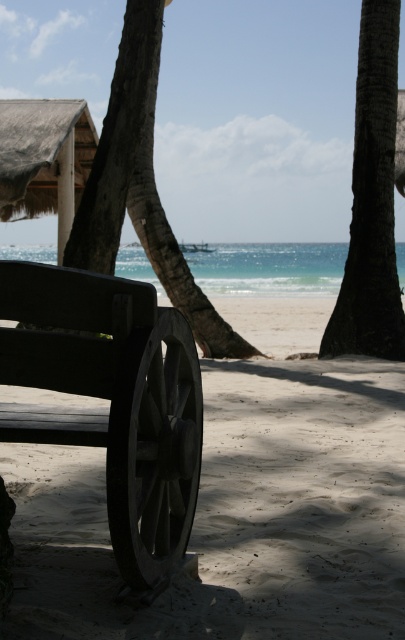
Question: Among these points, which one is farthest from the camera?

Choices:
 (A) (396, 336)
 (B) (138, 387)
 (C) (279, 426)
 (D) (130, 518)

Answer: (A)

Question: Which point is farther to the camera?

Choices:
 (A) wooden wheel at lower left
 (B) sandy beige at lower left
 (C) dark brown textured palm tree at center
 (D) wooden bench at lower left

Answer: (C)

Question: Is wooden bench at lower left in front of dark brown textured palm tree at center?

Choices:
 (A) no
 (B) yes

Answer: (B)

Question: Among these objects, which one is nearest to the camera?

Choices:
 (A) wooden wheel at lower left
 (B) wooden bench at lower left

Answer: (A)

Question: Does wooden wheel at lower left have a larger size compared to dark brown textured palm tree at center?

Choices:
 (A) no
 (B) yes

Answer: (A)

Question: In this image, where is wooden bench at lower left located relative to dark brown textured palm tree at center?

Choices:
 (A) above
 (B) below

Answer: (B)